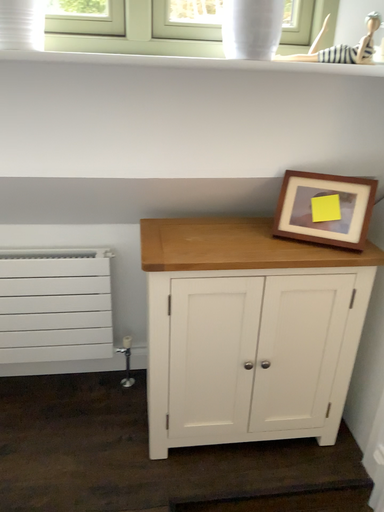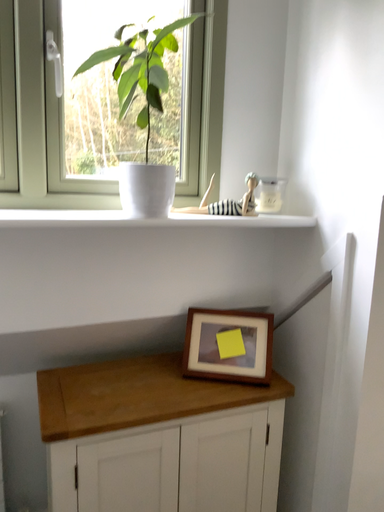
Question: How did the camera likely rotate when shooting the video?

Choices:
 (A) rotated downward
 (B) rotated upward

Answer: (B)